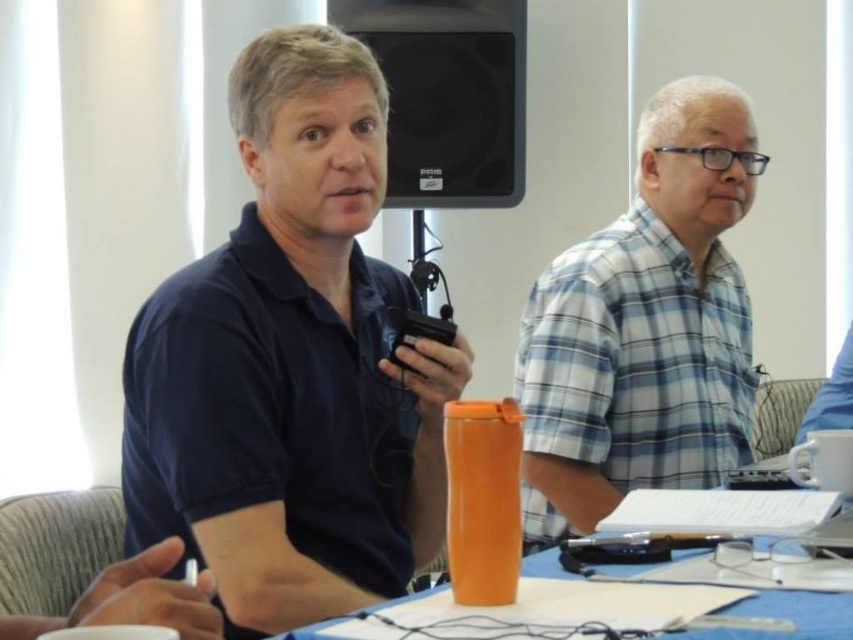
Who is shorter, dark blue shirt at center or blue plaid shirt at center?

Standing shorter between the two is dark blue shirt at center.

You are a GUI agent. You are given a task and a screenshot of the screen. Output one action in this format:
    pyautogui.click(x=<x>, y=<y>)
    Task: Click on the dark blue shirt at center
    Image resolution: width=853 pixels, height=640 pixels.
    Given the screenshot: What is the action you would take?
    pyautogui.click(x=291, y=364)

Between point (334, 128) and point (663, 401), which one is positioned in front?

Point (334, 128) is more forward.

At what (x,y) coordinates should I click in order to perform the action: click on dark blue shirt at center. Please return your answer as a coordinate pair (x, y). This screenshot has height=640, width=853. Looking at the image, I should click on (291, 364).

This screenshot has height=640, width=853. What do you see at coordinates (291, 364) in the screenshot? I see `dark blue shirt at center` at bounding box center [291, 364].

Is point (281, 337) positioned behind point (682, 611)?

That is True.

What are the coordinates of `dark blue shirt at center` in the screenshot? It's located at (291, 364).

Is blue plaid shirt at center thinner than orange plastic cup at center?

Yes.

Between point (579, 312) and point (560, 592), which one is positioned behind?

Point (579, 312)

Is point (585, 532) positioned in front of point (558, 611)?

No, (585, 532) is further to viewer.

At what (x,y) coordinates should I click in order to perform the action: click on blue plaid shirt at center. Please return your answer as a coordinate pair (x, y). Looking at the image, I should click on (645, 324).